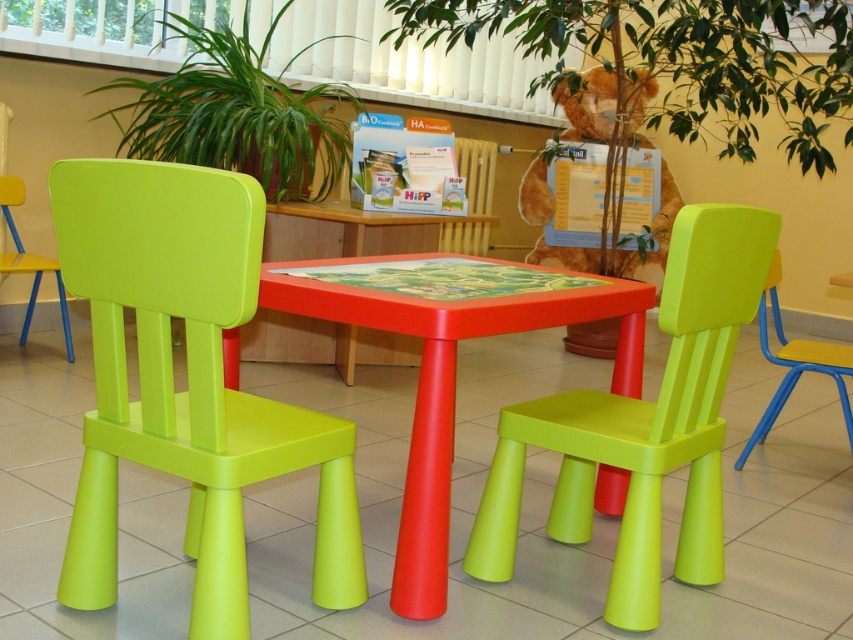
Does matte plastic table at center have a larger size compared to red plastic table at center?

Correct, matte plastic table at center is larger in size than red plastic table at center.

Is the position of matte plastic table at center more distant than that of red plastic table at center?

No, it is in front of red plastic table at center.

In order to click on matte plastic table at center in this screenshot , I will do `click(450, 387)`.

Which is behind, point (413, 468) or point (67, 342)?

Point (67, 342)

Who is more forward, (605, 296) or (27, 272)?

Point (605, 296)

Is point (383, 326) farther from viewer compared to point (33, 292)?

No.

The height and width of the screenshot is (640, 853). Identify the location of matte plastic table at center. (450, 387).

Which of these two, red plastic table at center or lime green plastic chair at left, stands shorter?

With less height is red plastic table at center.

Can you confirm if red plastic table at center is bigger than lime green plastic chair at left?

Incorrect, red plastic table at center is not larger than lime green plastic chair at left.

Who is more distant from viewer, (430, 232) or (39, 278)?

The point (430, 232) is behind.

I want to click on red plastic table at center, so click(x=361, y=230).